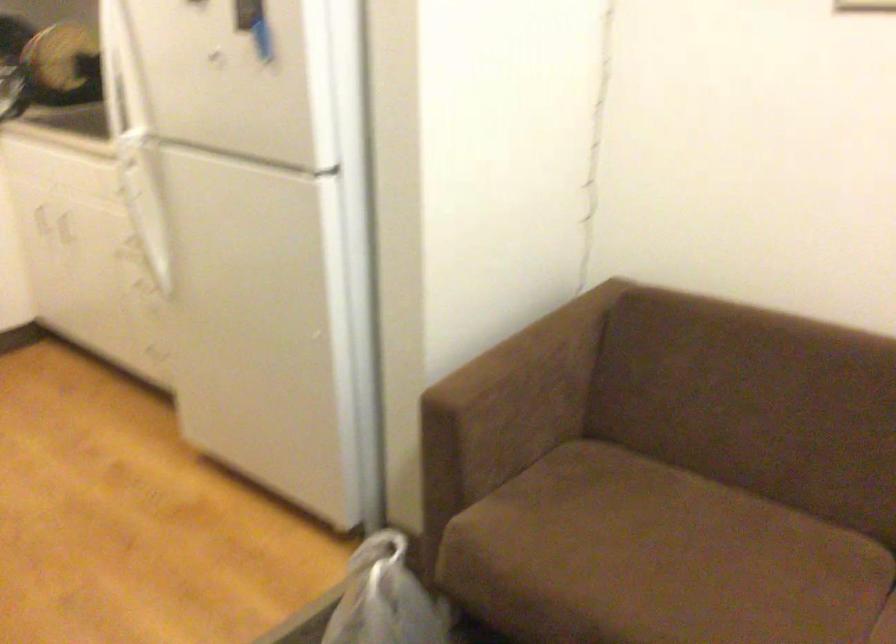
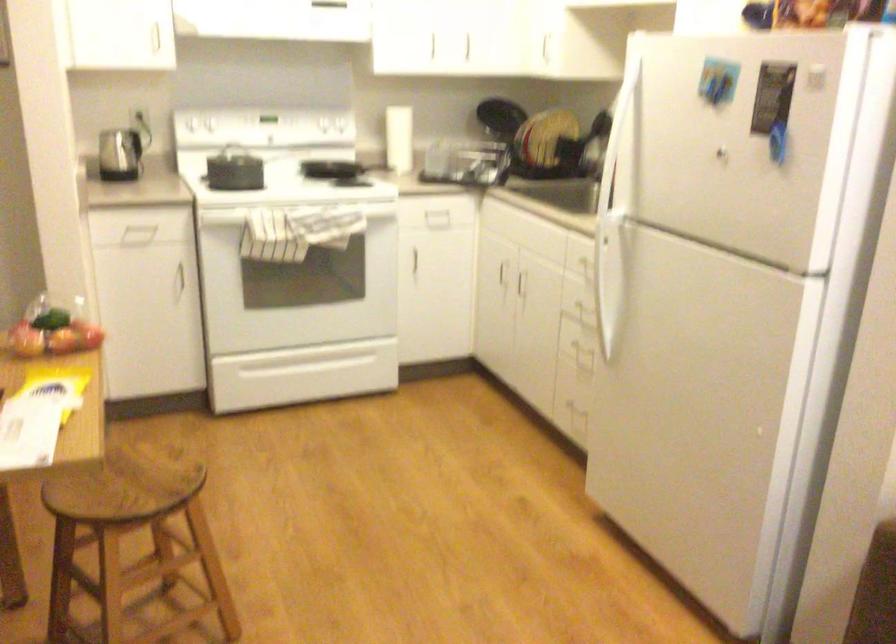
Locate, in the second image, the point that corresponds to (147,220) in the first image.

(607, 283)